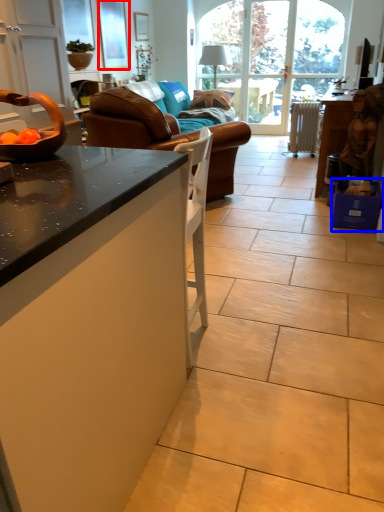
Question: Which point is closer to the camera, picture frame (highlighted by a red box) or box (highlighted by a blue box)?

Choices:
 (A) picture frame
 (B) box

Answer: (B)